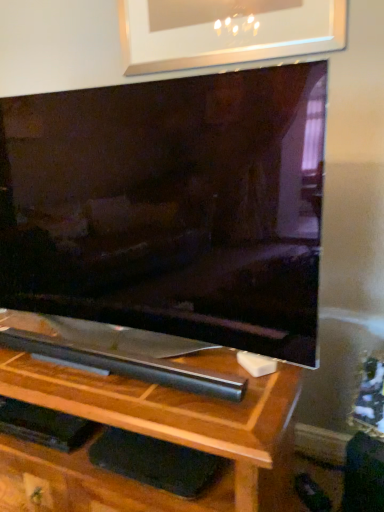
The width and height of the screenshot is (384, 512). Describe the element at coordinates (225, 32) in the screenshot. I see `white glossy picture frame at upper center` at that location.

This screenshot has height=512, width=384. I want to click on white glossy picture frame at upper center, so click(225, 32).

Identify the location of white glossy picture frame at upper center. This screenshot has height=512, width=384. (225, 32).